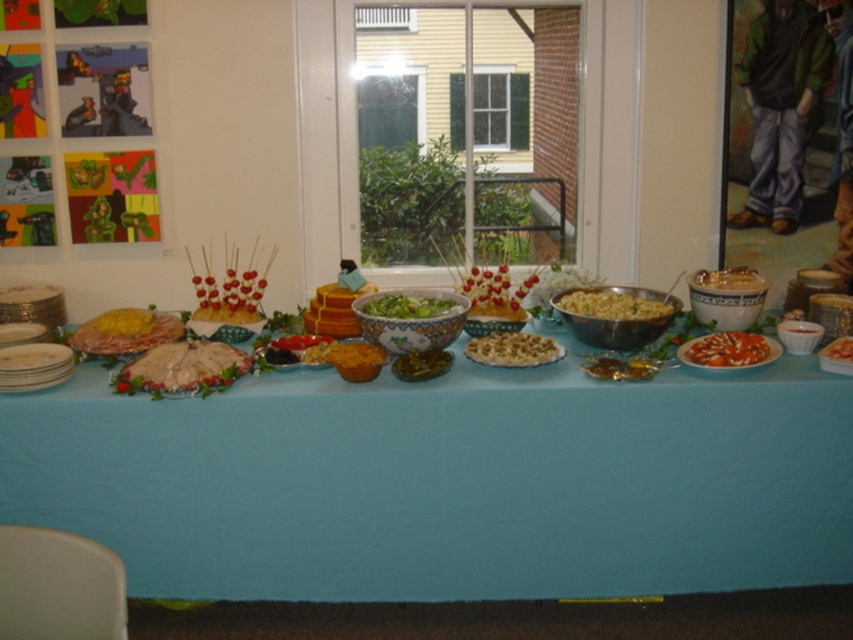
Does saucy pasta at center appear over smooth white cheese at center?

Actually, saucy pasta at center is below smooth white cheese at center.

Who is taller, saucy pasta at center or smooth white cheese at center?

saucy pasta at center is taller.

Is point (727, 365) less distant than point (836, 353)?

Yes, it is.

In order to click on saucy pasta at center in this screenshot , I will do `click(727, 349)`.

Does white creamy spread at center appear over smooth white cheese at center?

No, white creamy spread at center is not above smooth white cheese at center.

Who is more distant from viewer, (178, 380) or (846, 348)?

Point (846, 348)

Where is `white creamy spread at center`? white creamy spread at center is located at coordinates click(x=183, y=369).

Measure the distance between blue fabric tablecloth at center and yellow matte pasta at center.

blue fabric tablecloth at center is 18.85 inches from yellow matte pasta at center.

What do you see at coordinates (445, 483) in the screenshot? I see `blue fabric tablecloth at center` at bounding box center [445, 483].

You are a GUI agent. You are given a task and a screenshot of the screen. Output one action in this format:
    pyautogui.click(x=<x>, y=<y>)
    Task: Click on the blue fabric tablecloth at center
    
    Given the screenshot: What is the action you would take?
    pyautogui.click(x=445, y=483)